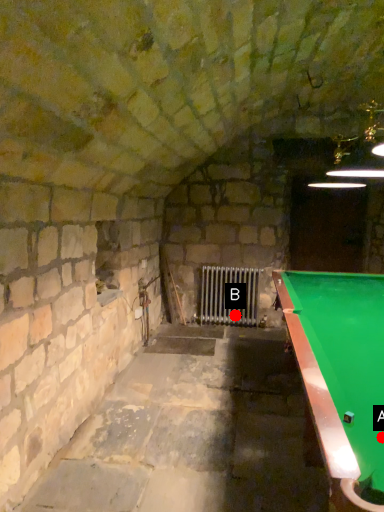
Question: Two points are circled on the image, labeled by A and B beside each circle. Which point is farther from the camera taking this photo?

Choices:
 (A) A is further
 (B) B is further

Answer: (B)